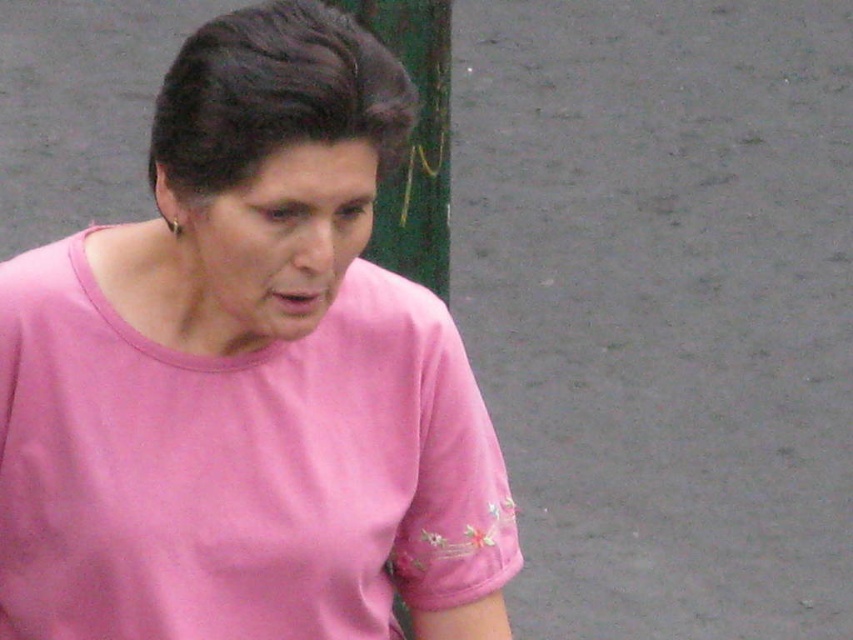
You are a photographer trying to capture the pink fabric shirt at center. The camera is set to focus at point (x=247, y=378). Will the focus point be on the pink fabric shirt at center?

Yes, the focus point at (x=247, y=378) corresponds to the pink fabric shirt at center, so it will be in focus.

You are a photographer trying to capture a portrait of the person wearing the pink fabric shirt at center. The green painted wood pole at upper center is blocking part of the shot. If you move closer to the person, will the pole appear smaller in the frame compared to the shirt?

The pink fabric shirt at center has a larger size compared to green painted wood pole at upper center. Moving closer to the person will make the shirt appear larger in the frame while the distance between you and the pole increases, causing the pole to appear smaller relative to the shirt.